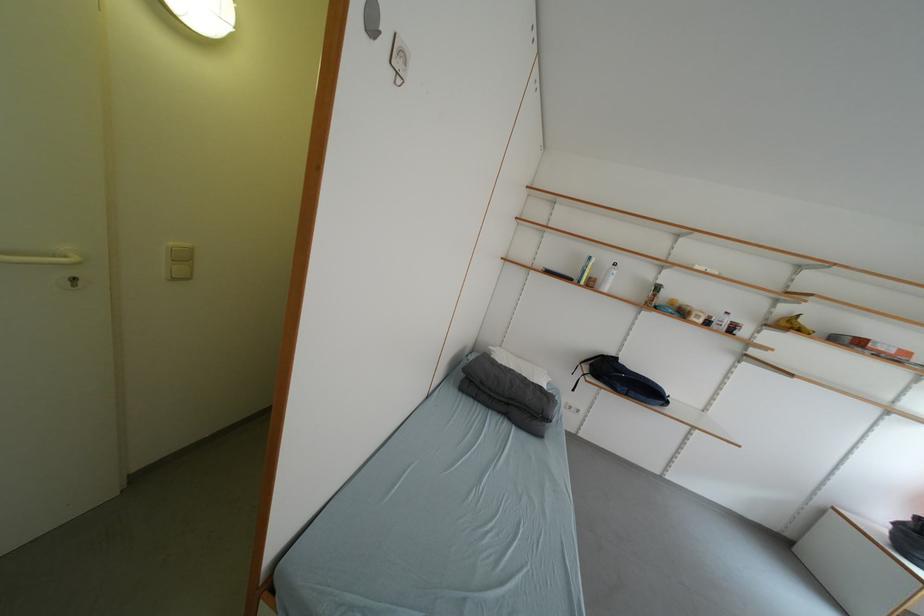
Find the location of a particular element. black backpack is located at coordinates (624, 379).